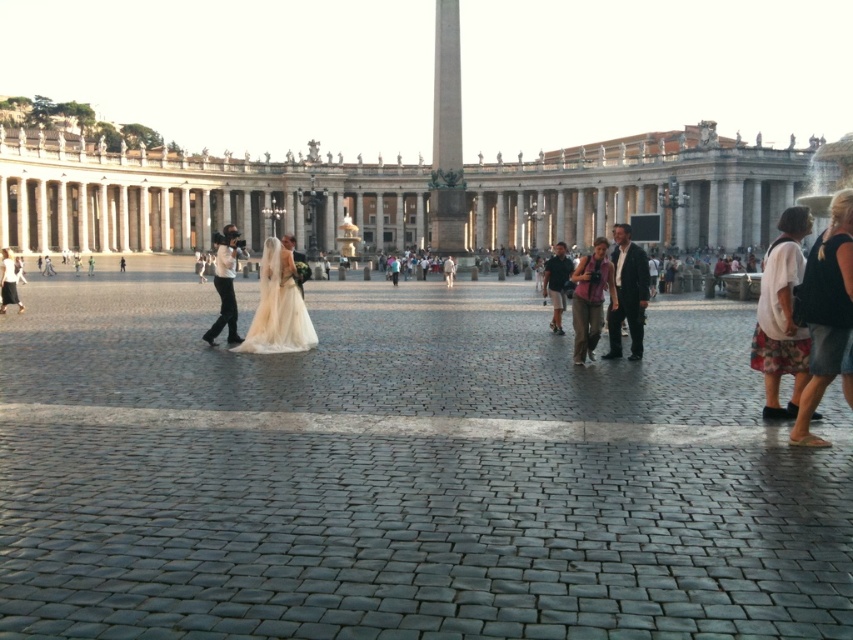
You are a photographer at St. Peter Square and want to take a picture of the ivory satin dress at center and the white cotton shirt at center. Which one should you focus on first if you want to capture the taller subject?

The white cotton shirt at center is taller than ivory satin dress at center, so you should focus on the white cotton shirt at center first.

You are a photographer planning to take a picture of the smooth stone plaza at center and the dark gray suit at center in St. Peter Square. Based on their relative sizes in the image, which object would appear larger in the photo?

The smooth stone plaza at center appears larger in the photo because it is much taller than the dark gray suit at center.

In the scene shown: You are standing at the cobblestone plaza in St. Peter Square and see a point marked at coordinates (195, 196). According to the image, where is this point located?

The point is located on the white marble palace at center.